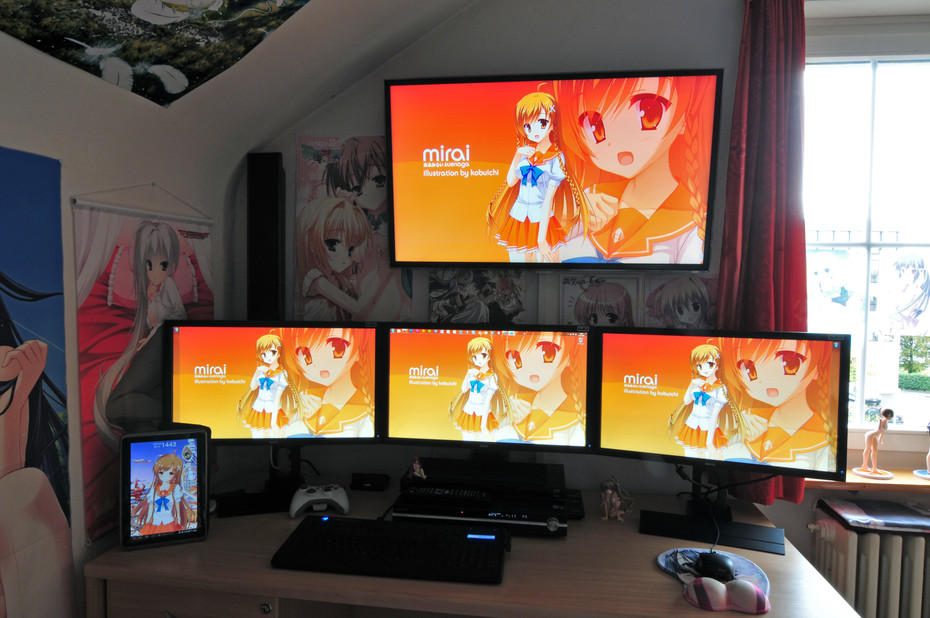
I want to click on screen 3, so click(x=769, y=418).